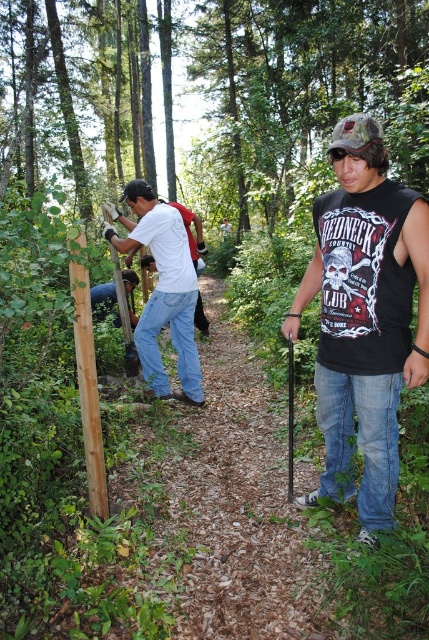
Question: Can you confirm if black sleeveless shirt at center is thinner than matte white shirt at center?

Choices:
 (A) yes
 (B) no

Answer: (A)

Question: Among these points, which one is nearest to the camera?

Choices:
 (A) click(398, 358)
 (B) click(166, 280)

Answer: (A)

Question: In this image, where is black sleeveless shirt at center located relative to matte white shirt at center?

Choices:
 (A) left
 (B) right

Answer: (B)

Question: Among these points, which one is nearest to the camera?

Choices:
 (A) 356,220
 (B) 159,296

Answer: (A)

Question: From the image, what is the correct spatial relationship of black sleeveless shirt at center in relation to matte white shirt at center?

Choices:
 (A) below
 (B) above

Answer: (A)